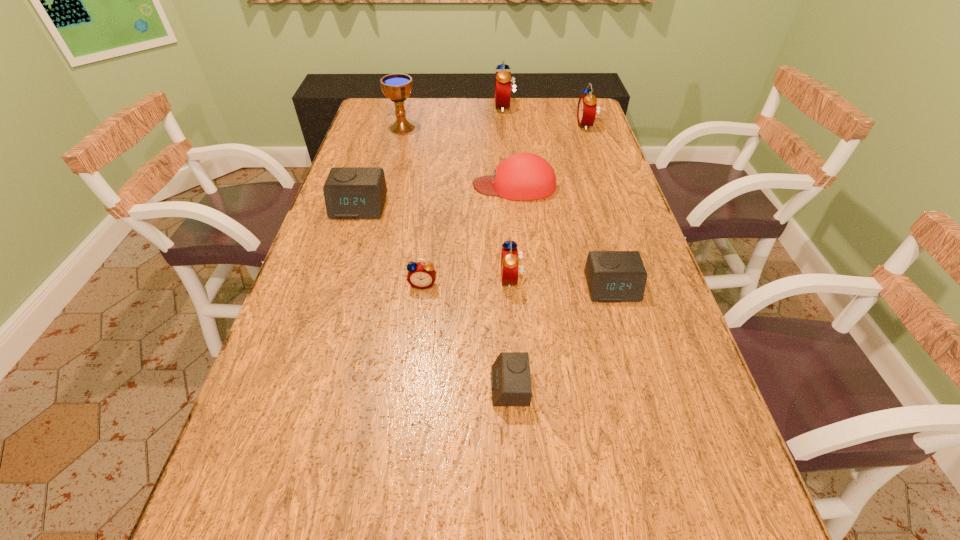
The height and width of the screenshot is (540, 960). In the image, there is a desktop. In order to click on vacant space at the left edge in this screenshot , I will do tap(382, 166).

Identify the location of vacant space at the right edge of the desktop. This screenshot has width=960, height=540. (613, 248).

Identify the location of free spot between the second smallest black alarm clock and the second black alarm clock from left to right. This screenshot has height=540, width=960. (561, 338).

Find the location of a particular element. This screenshot has width=960, height=540. free space between the leftmost black alarm clock and the shortest alarm clock is located at coordinates (434, 297).

Find the location of a particular element. This screenshot has height=540, width=960. unoccupied area between the nearest object and the sixth shortest alarm clock is located at coordinates (548, 256).

Image resolution: width=960 pixels, height=540 pixels. Find the location of `free space between the baseball cap and the blue chalice`. free space between the baseball cap and the blue chalice is located at coordinates (x=458, y=157).

Identify the location of free space between the nearest alarm clock and the seventh object from right to left. The width and height of the screenshot is (960, 540). coord(467,335).

At what (x,y) coordinates should I click in order to perform the action: click on vacant space that's between the rightmost red alarm clock and the fifth nearest alarm clock. Please return your answer as a coordinate pair (x, y). This screenshot has height=540, width=960. Looking at the image, I should click on (472, 166).

Image resolution: width=960 pixels, height=540 pixels. In order to click on vacant space in between the fifth shortest alarm clock and the nearest black alarm clock in this screenshot , I will do `click(511, 333)`.

This screenshot has height=540, width=960. What are the coordinates of `vacant area that lies between the fifth nearest alarm clock and the blue chalice` in the screenshot? It's located at (381, 167).